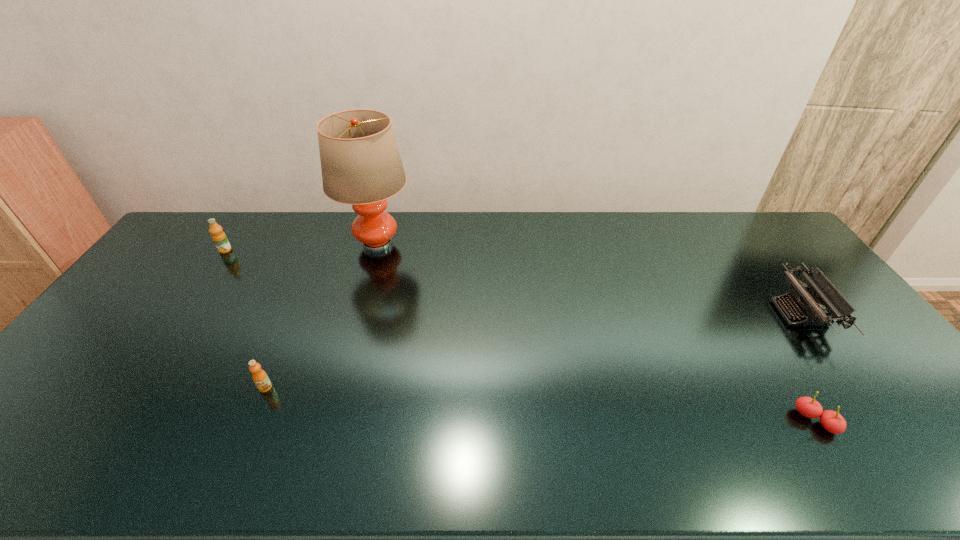
At what (x,y) coordinates should I click in order to perform the action: click on vacant region at the far edge. Please return your answer as a coordinate pair (x, y). This screenshot has height=540, width=960. Looking at the image, I should click on (484, 224).

The width and height of the screenshot is (960, 540). I want to click on vacant point at the near edge, so pyautogui.click(x=761, y=450).

Identify the location of vacant space at the left edge of the desktop. Image resolution: width=960 pixels, height=540 pixels. (36, 415).

Find the location of a particular element. vacant space at the right edge of the desktop is located at coordinates (788, 267).

In the image, there is a desktop. Where is `vacant space at the far left corner`? vacant space at the far left corner is located at coordinates (186, 224).

Identify the location of vacant area that lies between the lamp and the nearest object. (596, 332).

Locate an element on the screen. free space between the leftmost object and the shortest object is located at coordinates (520, 335).

The image size is (960, 540). Find the location of `free space between the rightmost object and the shortest object`. free space between the rightmost object and the shortest object is located at coordinates (807, 367).

Find the location of `vacant space in between the fourth farthest object and the third object from right to left`. vacant space in between the fourth farthest object and the third object from right to left is located at coordinates (322, 315).

Where is `vacant space that's between the third nearest object and the right orange juice`? The image size is (960, 540). vacant space that's between the third nearest object and the right orange juice is located at coordinates (533, 350).